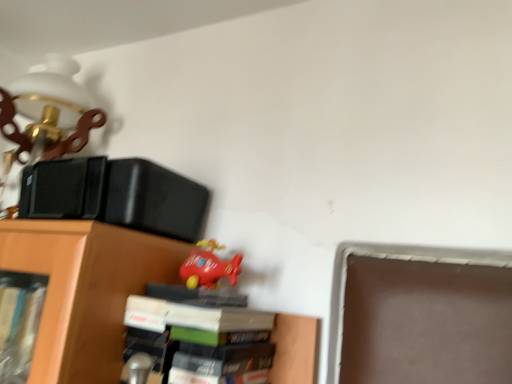
What do you see at coordinates (199, 336) in the screenshot?
I see `hardcover book at center` at bounding box center [199, 336].

Identify the location of hardcover book at center. (199, 336).

Image resolution: width=512 pixels, height=384 pixels. What do you see at coordinates (209, 266) in the screenshot? I see `rubberized red airplane at upper center` at bounding box center [209, 266].

You are a GUI agent. You are given a task and a screenshot of the screen. Output one action in this format:
    pyautogui.click(x=<x>, y=<y>)
    Task: Click on the rubberized red airplane at upper center
    
    Given the screenshot: What is the action you would take?
    pyautogui.click(x=209, y=266)

The width and height of the screenshot is (512, 384). Find the location of `hardcover book at center`. hardcover book at center is located at coordinates (199, 336).

Consider the image. Between rubberized red airplane at upper center and hardcover book at center, which one appears on the left side from the viewer's perspective?

Positioned to the left is rubberized red airplane at upper center.

Considering the positions of objects rubberized red airplane at upper center and hardcover book at center in the image provided, who is in front, rubberized red airplane at upper center or hardcover book at center?

Positioned in front is hardcover book at center.

Considering the positions of point (194, 266) and point (198, 374), is point (194, 266) closer or farther from the camera than point (198, 374)?

Point (194, 266) is positioned farther from the camera compared to point (198, 374).

From the image's perspective, relative to hardcover book at center, is rubberized red airplane at upper center above or below?

Clearly, from the image's perspective, rubberized red airplane at upper center is above hardcover book at center.

From a real-world perspective, is rubberized red airplane at upper center beneath hardcover book at center?

No, from a real-world perspective, rubberized red airplane at upper center is not below hardcover book at center.

Looking at their sizes, would you say rubberized red airplane at upper center is wider or thinner than hardcover book at center?

Considering their sizes, rubberized red airplane at upper center looks slimmer than hardcover book at center.

Considering the relative sizes of rubberized red airplane at upper center and hardcover book at center in the image provided, is rubberized red airplane at upper center taller than hardcover book at center?

In fact, rubberized red airplane at upper center may be shorter than hardcover book at center.

Considering the relative sizes of rubberized red airplane at upper center and hardcover book at center in the image provided, is rubberized red airplane at upper center smaller than hardcover book at center?

Indeed, rubberized red airplane at upper center has a smaller size compared to hardcover book at center.

Is rubberized red airplane at upper center completely or partially outside of hardcover book at center?

Yes, rubberized red airplane at upper center is outside of hardcover book at center.

Can you see rubberized red airplane at upper center touching hardcover book at center?

There is a gap between rubberized red airplane at upper center and hardcover book at center.

Could you tell me if rubberized red airplane at upper center is facing hardcover book at center?

No, rubberized red airplane at upper center is not aimed at hardcover book at center.

How much distance is there between rubberized red airplane at upper center and hardcover book at center?

They are 4.61 inches apart.

Where is `toy above the hardcover book at center (from a real-world perspective)`? The image size is (512, 384). toy above the hardcover book at center (from a real-world perspective) is located at coordinates (209, 266).

Would you say hardcover book at center is to the left or to the right of rubberized red airplane at upper center in the picture?

In the image, hardcover book at center appears on the right side of rubberized red airplane at upper center.

Is hardcover book at center positioned behind rubberized red airplane at upper center?

No, hardcover book at center is closer to the viewer.

Does point (250, 361) appear closer or farther from the camera than point (183, 274)?

Point (250, 361).

From the image's perspective, is hardcover book at center over rubberized red airplane at upper center?

Incorrect, from the image's perspective, hardcover book at center is lower than rubberized red airplane at upper center.

From a real-world perspective, is hardcover book at center physically above rubberized red airplane at upper center?

No, from a real-world perspective, hardcover book at center is not over rubberized red airplane at upper center

From the picture: Is hardcover book at center thinner than rubberized red airplane at upper center?

Incorrect, the width of hardcover book at center is not less than that of rubberized red airplane at upper center.

Is hardcover book at center taller than rubberized red airplane at upper center?

Correct, hardcover book at center is much taller as rubberized red airplane at upper center.

Who is bigger, hardcover book at center or rubberized red airplane at upper center?

hardcover book at center.

Choose the correct answer: Is hardcover book at center inside rubberized red airplane at upper center or outside it?

hardcover book at center is not enclosed by rubberized red airplane at upper center.

Is hardcover book at center next to rubberized red airplane at upper center?

No.

Is hardcover book at center aimed at rubberized red airplane at upper center?

No, hardcover book at center is not facing towards rubberized red airplane at upper center.

What's the angular difference between hardcover book at center and rubberized red airplane at upper center's facing directions?

The angle between the facing direction of hardcover book at center and the facing direction of rubberized red airplane at upper center is 5.99 degrees.

How distant is hardcover book at center from rubberized red airplane at upper center?

A distance of 4.61 inches exists between hardcover book at center and rubberized red airplane at upper center.

Identify the location of toy that is above the hardcover book at center (from the image's perspective). (209, 266).

Identify the location of toy behind the hardcover book at center. This screenshot has width=512, height=384. [x=209, y=266].

Locate an element on the screen. The width and height of the screenshot is (512, 384). book that appears below the rubberized red airplane at upper center (from a real-world perspective) is located at coordinates coord(199,336).